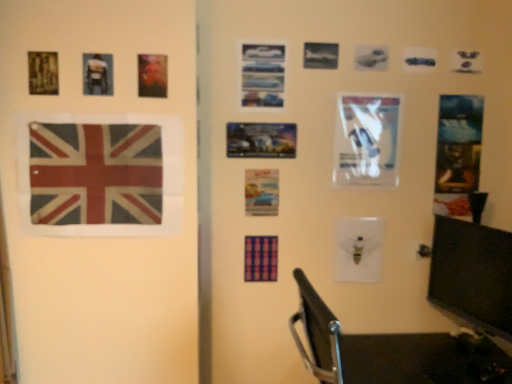
Question: Looking at the image, does matte black backpack at upper left, placed as the 2th picture frame when sorted from back to front, seem bigger or smaller compared to metallic blue postcard at upper center, the 4th postcard viewed from the back?

Choices:
 (A) small
 (B) big

Answer: (A)

Question: Would you say matte black backpack at upper left, placed as the 2th picture frame when sorted from back to front, is to the left or to the right of metallic blue postcard at upper center, the 3th postcard positioned from the right, in the picture?

Choices:
 (A) left
 (B) right

Answer: (A)

Question: Based on their relative distances, which object is farther from the metallic blue postcard at upper center, the 4th postcard viewed from the back?

Choices:
 (A) white glossy paper at center right, which ranks as the 3th postcard in back-to-front order
 (B) textured fabric flag at left
 (C) black glossy monitor at right
 (D) shiny metallic postcard at upper left, which appears as the fifth postcard when viewed from the right
 (E) metallic silver poster at center, which appears as the second picture frame when viewed from the left

Answer: (C)

Question: Which object is the farthest from the metallic silver poster at center, placed as the first picture frame when sorted from back to front?

Choices:
 (A) metallic blue postcard at upper center, the second postcard from the front
 (B) black glossy monitor at right
 (C) metallic silver poster at right, the 1th postcard positioned from the back
 (D) shiny metallic postcard at upper left, which ranks as the fifth postcard in back-to-front order
 (E) textured fabric flag at left

Answer: (B)